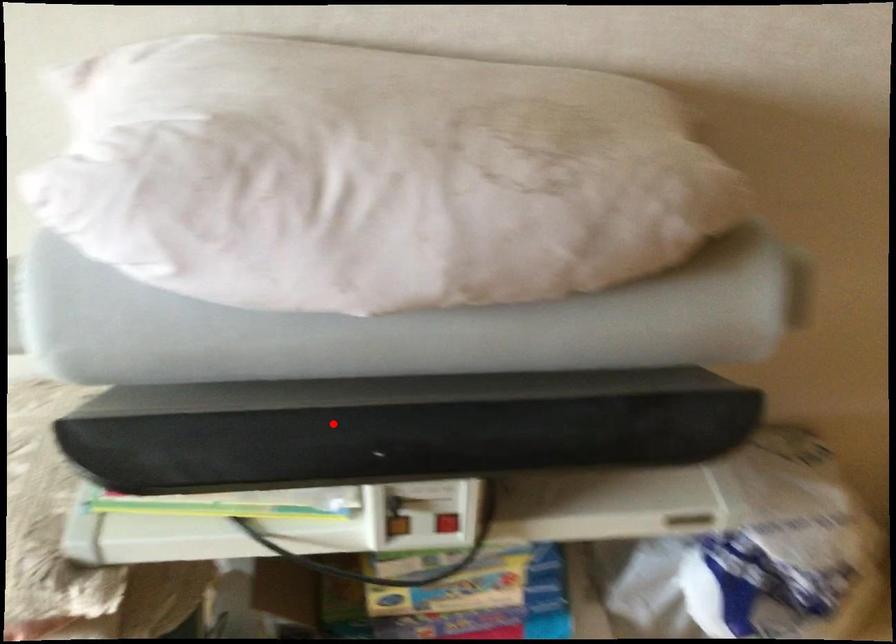
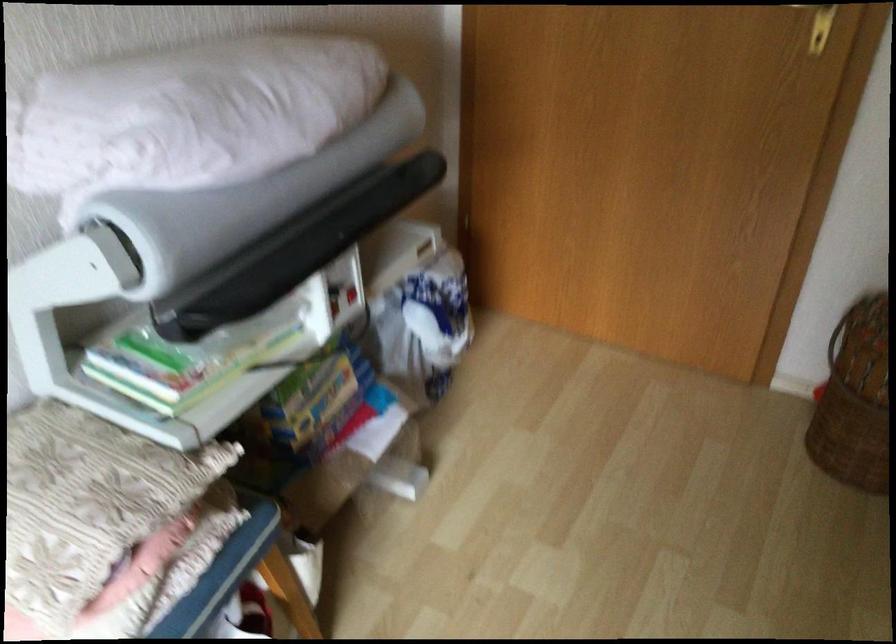
Question: I am providing you with two images of the same scene from different viewpoints. A red point is shown in image1. For the corresponding object point in image2, is it positioned nearer or farther from the camera?

Choices:
 (A) Nearer
 (B) Farther

Answer: (B)